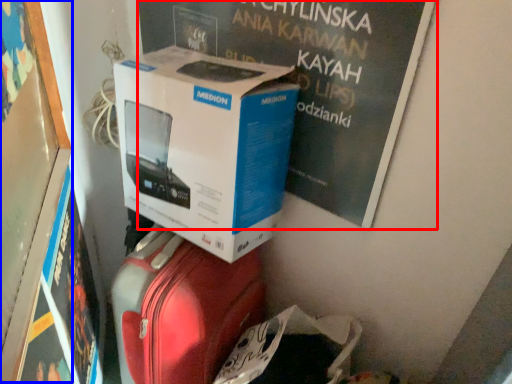
Question: Which point is further to the camera, magazine (highlighted by a red box) or bulletin board (highlighted by a blue box)?

Choices:
 (A) magazine
 (B) bulletin board

Answer: (A)